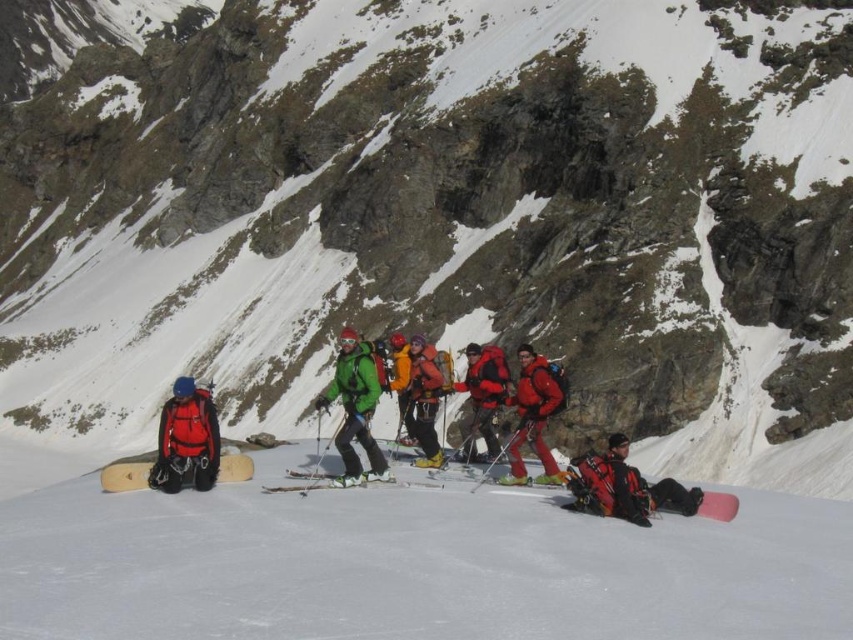
Question: Which of the following is the closest to the observer?

Choices:
 (A) (450, 534)
 (B) (395, 381)
 (C) (409, 392)

Answer: (A)

Question: Which object appears farthest from the camera in this image?

Choices:
 (A) matte red jacket at center
 (B) matte orange jacket at center
 (C) red matte backpack at left
 (D) red synthetic jacket at center

Answer: (B)

Question: Where is matte red jacket at center located in relation to yellow matte jacket at center in the image?

Choices:
 (A) right
 (B) left

Answer: (A)

Question: Does red matte backpack at left have a lesser width compared to red synthetic jacket at center?

Choices:
 (A) yes
 (B) no

Answer: (B)

Question: Estimate the real-world distances between objects in this image. Which object is farther from the white snowboard at center?

Choices:
 (A) green matte jacket at center
 (B) red synthetic jacket at center
 (C) yellow matte jacket at center

Answer: (C)

Question: Is red synthetic jacket at center behind matte orange jacket at center?

Choices:
 (A) no
 (B) yes

Answer: (A)